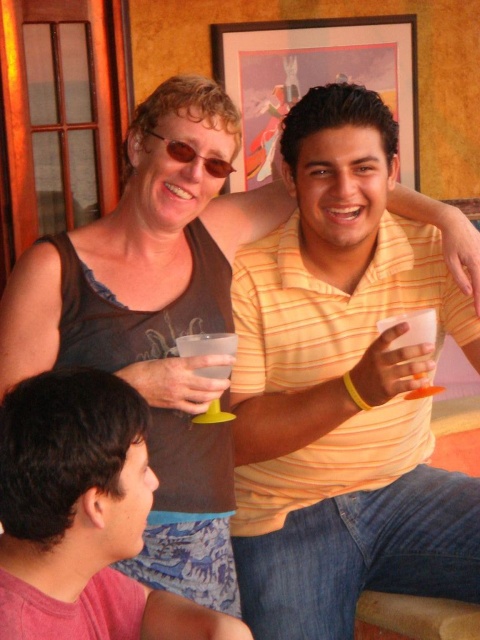
Question: Which of the following is the farthest from the observer?

Choices:
 (A) clear plastic cup at upper center
 (B) yellow striped polo shirt at center

Answer: (A)

Question: Is pink fabric shirt at lower left above matte brown sunglasses at upper center?

Choices:
 (A) yes
 (B) no

Answer: (B)

Question: Estimate the real-world distances between objects in this image. Which object is closer to the yellow striped polo shirt at center?

Choices:
 (A) matte brown sunglasses at upper center
 (B) pink fabric shirt at lower left

Answer: (B)

Question: Is yellow striped polo shirt at center in front of pink fabric shirt at lower left?

Choices:
 (A) no
 (B) yes

Answer: (A)

Question: Is yellow striped polo shirt at center positioned behind pink fabric shirt at lower left?

Choices:
 (A) no
 (B) yes

Answer: (B)

Question: Among these points, which one is nearest to the camera?

Choices:
 (A) (223, 172)
 (B) (207, 417)

Answer: (A)